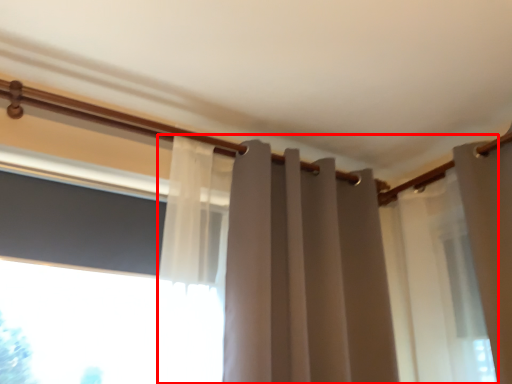
Question: Where is curtain (annotated by the red box) located in relation to window screen in the image?

Choices:
 (A) left
 (B) right

Answer: (B)